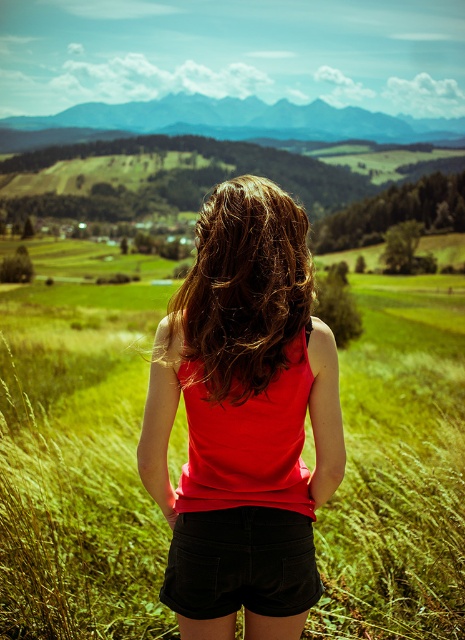
Question: Which point is closer to the camera?

Choices:
 (A) matte red tank top at center
 (B) black denim shorts at center
 (C) shiny brown hair at center

Answer: (A)

Question: Which point is farther from the camera taking this photo?

Choices:
 (A) (276, 554)
 (B) (248, 237)
 (C) (239, 513)

Answer: (A)

Question: Is matte red tank top at center below shiny brown hair at center?

Choices:
 (A) no
 (B) yes

Answer: (B)

Question: Can you confirm if matte red tank top at center is thinner than black denim shorts at center?

Choices:
 (A) yes
 (B) no

Answer: (B)

Question: Among these objects, which one is farthest from the camera?

Choices:
 (A) shiny brown hair at center
 (B) matte red tank top at center

Answer: (A)

Question: Does matte red tank top at center appear on the left side of black denim shorts at center?

Choices:
 (A) yes
 (B) no

Answer: (B)